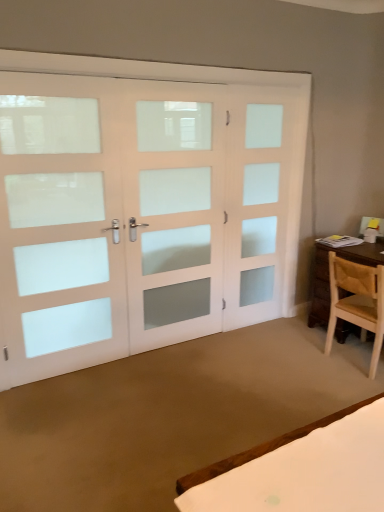
The width and height of the screenshot is (384, 512). What are the coordinates of `free space above white frosted glass door at center, placed as the second screen door when sorted from left to right (from a real-world perspective)` in the screenshot? It's located at (180, 77).